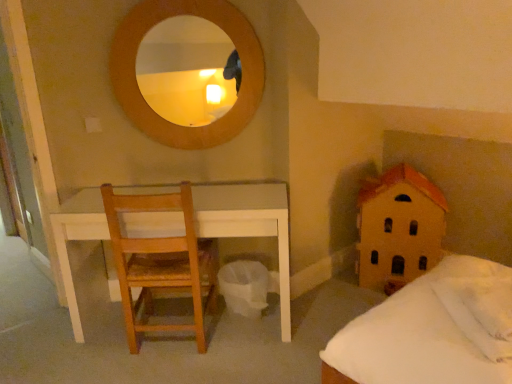
Locate an element on the screen. The height and width of the screenshot is (384, 512). unoccupied region to the right of light brown wooden chair at left is located at coordinates (248, 350).